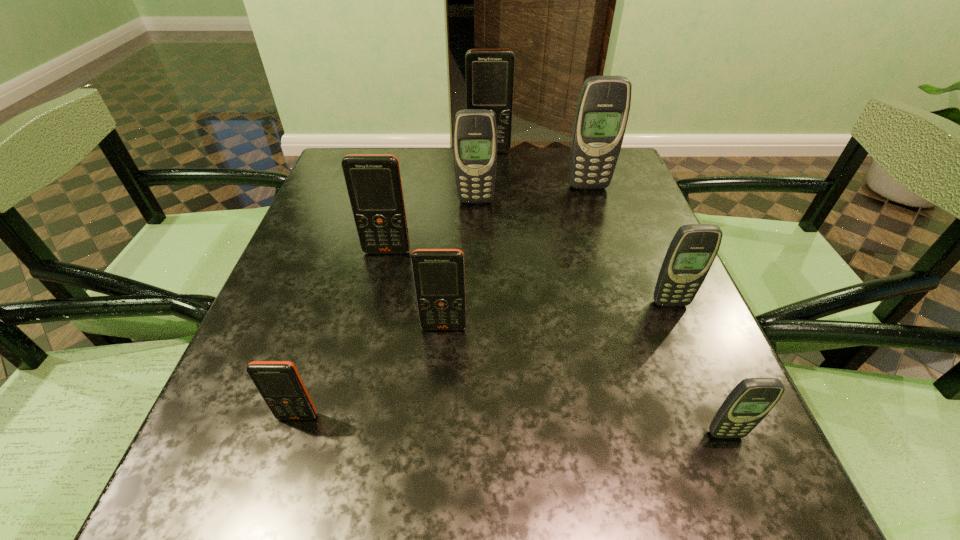
Find the location of a particular element. The image size is (960, 540). free spot at the near left corner of the desktop is located at coordinates (249, 505).

Locate an element on the screen. This screenshot has height=540, width=960. vacant region at the near right corner of the desktop is located at coordinates (771, 490).

Locate an element on the screen. vacant area between the nearest object and the fifth nearest object is located at coordinates (556, 343).

Locate an element on the screen. The image size is (960, 540). vacant space in between the smallest gray cellular telephone and the third farthest object is located at coordinates (601, 318).

Find the location of a particular element. The height and width of the screenshot is (540, 960). unoccupied area between the third smallest gray cellular telephone and the farthest gray cellular telephone is located at coordinates (532, 194).

Identify the location of vacant area that lies between the fourth nearest object and the third nearest cellular telephone. This screenshot has width=960, height=540. (557, 315).

Find the location of `free spot between the sixth farthest object and the farthest cellular telephone`. free spot between the sixth farthest object and the farthest cellular telephone is located at coordinates (467, 239).

The height and width of the screenshot is (540, 960). I want to click on empty space between the second nearest gray cellular telephone and the third farthest object, so click(573, 252).

The image size is (960, 540). What are the coordinates of `unoccupied area between the sixth farthest object and the farthest object` in the screenshot? It's located at (467, 239).

Locate an element on the screen. The height and width of the screenshot is (540, 960). vacant area that lies between the farthest object and the fifth farthest cellular telephone is located at coordinates click(580, 227).